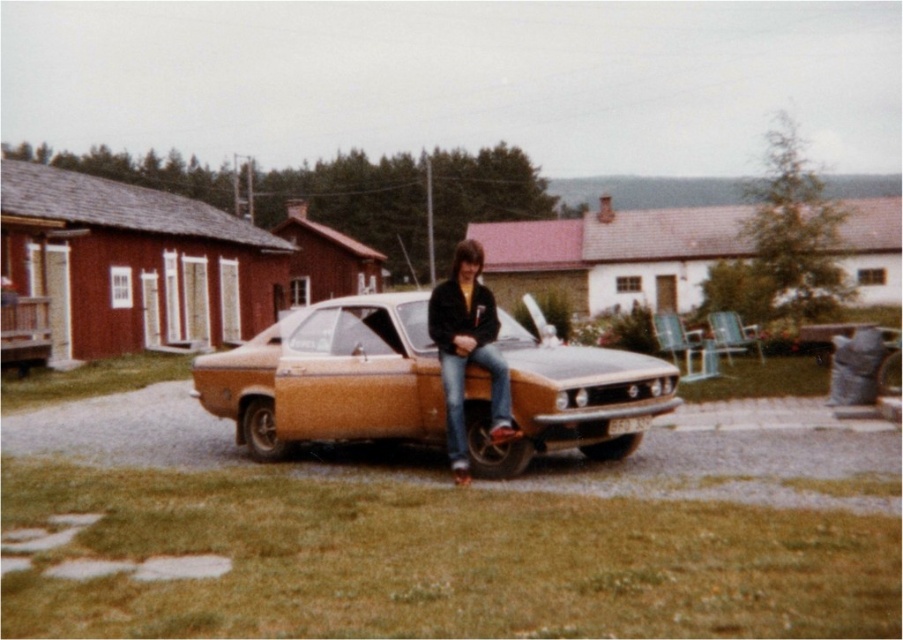
Is matte orange car at center below jeans at center?

Yes.

Based on the photo, can you confirm if matte orange car at center is shorter than jeans at center?

Yes.

Measure the distance between matte orange car at center and camera.

The distance of matte orange car at center from camera is 23.83 feet.

You are a GUI agent. You are given a task and a screenshot of the screen. Output one action in this format:
    pyautogui.click(x=<x>, y=<y>)
    Task: Click on the matte orange car at center
    The image size is (903, 640).
    Given the screenshot: What is the action you would take?
    pyautogui.click(x=330, y=378)